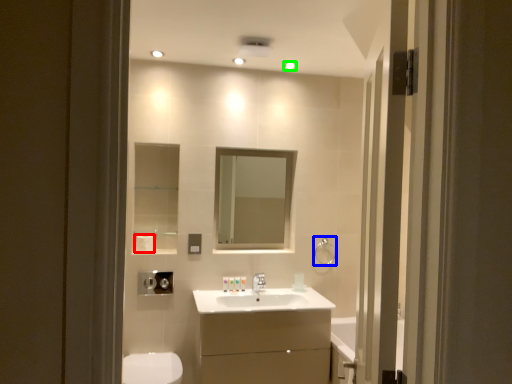
Question: Which object is positioned farthest from toilet paper (highlighted by a red box)? Select from towel bar (highlighted by a blue box) and light fixture (highlighted by a green box).

Choices:
 (A) towel bar
 (B) light fixture

Answer: (B)